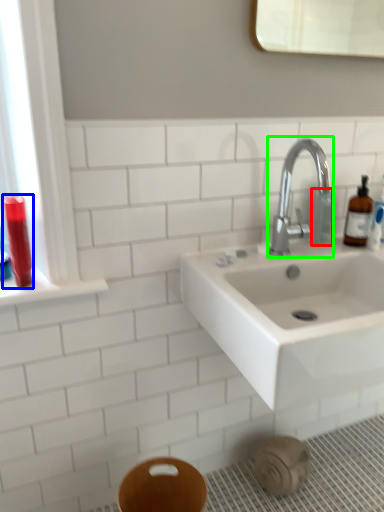
Question: Based on their relative distances, which object is nearer to toiletry (highlighted by a red box)? Choose from mouthwash (highlighted by a blue box) and tap (highlighted by a green box).

Choices:
 (A) mouthwash
 (B) tap

Answer: (B)